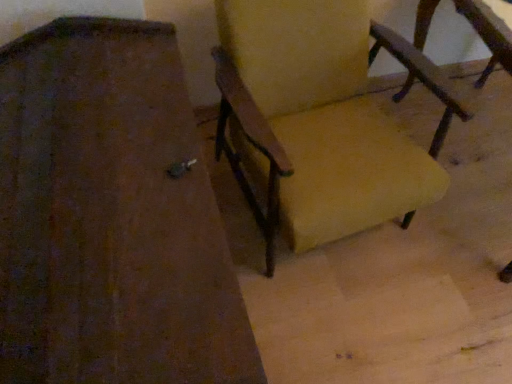
Question: Is wooden chair at right, the second chair positioned from the right, situated inside yellow fabric chair at center, the first chair in the right-to-left sequence, or outside?

Choices:
 (A) inside
 (B) outside

Answer: (B)

Question: Visually, is wooden chair at right, which appears as the 1th chair when viewed from the left, positioned to the left or to the right of yellow fabric chair at center, marked as the 2th chair in a left-to-right arrangement?

Choices:
 (A) left
 (B) right

Answer: (A)

Question: Looking at the image, does wooden chair at right, which appears as the 1th chair when viewed from the left, seem bigger or smaller compared to yellow fabric chair at center, the first chair in the right-to-left sequence?

Choices:
 (A) big
 (B) small

Answer: (A)

Question: Is yellow fabric chair at center, marked as the 2th chair in a left-to-right arrangement, bigger or smaller than wooden chair at right, which appears as the 1th chair when viewed from the left?

Choices:
 (A) small
 (B) big

Answer: (A)

Question: Considering the relative positions of yellow fabric chair at center, the first chair in the right-to-left sequence, and wooden chair at right, the second chair positioned from the right, in the image provided, is yellow fabric chair at center, the first chair in the right-to-left sequence, to the left or to the right of wooden chair at right, the second chair positioned from the right,?

Choices:
 (A) left
 (B) right

Answer: (B)

Question: From the image's perspective, is yellow fabric chair at center, marked as the 2th chair in a left-to-right arrangement, above or below wooden chair at right, which appears as the 1th chair when viewed from the left?

Choices:
 (A) below
 (B) above

Answer: (B)

Question: Do you think yellow fabric chair at center, marked as the 2th chair in a left-to-right arrangement, is within wooden chair at right, the second chair positioned from the right, or outside of it?

Choices:
 (A) inside
 (B) outside

Answer: (B)